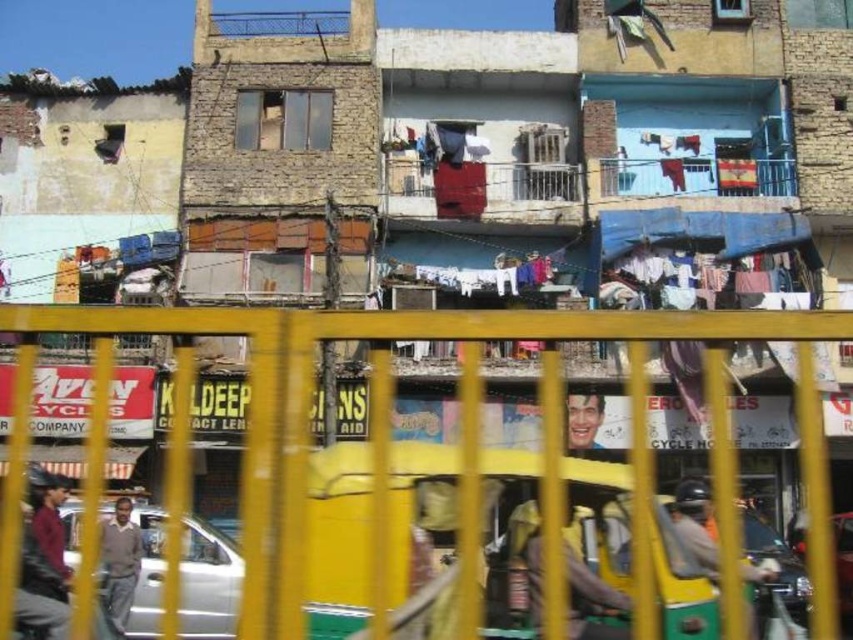
How far apart are yellow metal fence at center and smooth plastic face at center?

They are 12.19 feet apart.

The height and width of the screenshot is (640, 853). What do you see at coordinates (387, 435) in the screenshot?
I see `yellow metal fence at center` at bounding box center [387, 435].

Find the location of `yellow metal fence at center`. yellow metal fence at center is located at coordinates (387, 435).

Is yellow metal fence at center to the right of silver metallic car at lower left from the viewer's perspective?

Correct, you'll find yellow metal fence at center to the right of silver metallic car at lower left.

Can you confirm if yellow metal fence at center is positioned to the left of silver metallic car at lower left?

In fact, yellow metal fence at center is to the right of silver metallic car at lower left.

Where is `yellow metal fence at center`? The width and height of the screenshot is (853, 640). yellow metal fence at center is located at coordinates (387, 435).

You are a GUI agent. You are given a task and a screenshot of the screen. Output one action in this format:
    pyautogui.click(x=<x>, y=<y>)
    Task: Click on the yellow metal fence at center
    The height and width of the screenshot is (640, 853).
    Given the screenshot: What is the action you would take?
    pyautogui.click(x=387, y=435)

How distant is silver metallic car at lower left from shiny silver car at center?

They are 10.20 meters apart.

Who is shorter, silver metallic car at lower left or shiny silver car at center?

shiny silver car at center is shorter.

Which is behind, point (206, 572) or point (833, 532)?

Positioned behind is point (833, 532).

Identify the location of silver metallic car at lower left. click(x=207, y=582).